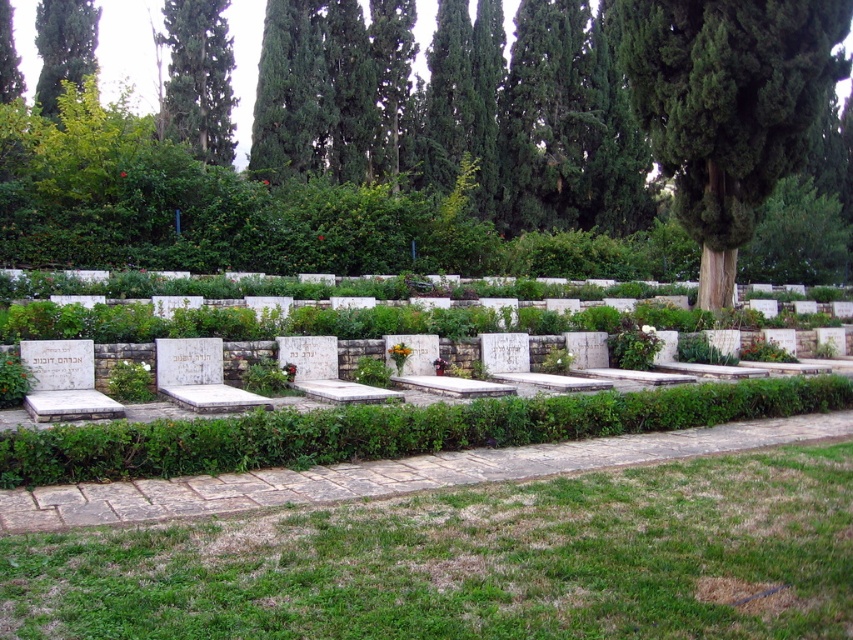
Who is shorter, green grass at lower center or green leafy tree at upper left?

Standing shorter between the two is green grass at lower center.

Is green grass at lower center above green leafy tree at upper left?

Incorrect, green grass at lower center is not positioned above green leafy tree at upper left.

Which is in front, point (785, 625) or point (42, 68)?

Positioned in front is point (785, 625).

Find the location of a particular element. The width and height of the screenshot is (853, 640). green grass at lower center is located at coordinates (474, 561).

Which is more to the right, green leafy tree at center or green grass at lower center?

From the viewer's perspective, green leafy tree at center appears more on the right side.

Find the location of a particular element. green leafy tree at center is located at coordinates (465, 148).

Identify the location of green leafy tree at center. This screenshot has width=853, height=640. (465, 148).

Is green textured tree at center smaller than green leafy tree at upper center?

No, green textured tree at center is not smaller than green leafy tree at upper center.

Which is more to the right, green textured tree at center or green leafy tree at upper center?

green textured tree at center

Is point (711, 164) farther from viewer compared to point (190, 92)?

No, (711, 164) is in front of (190, 92).

The width and height of the screenshot is (853, 640). Identify the location of green textured tree at center. (728, 106).